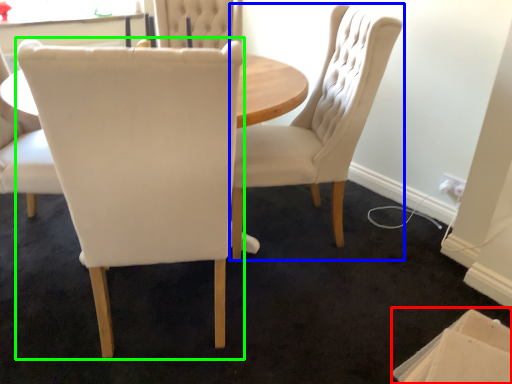
Question: Estimate the real-world distances between objects in this image. Which object is closer to cardboard box (highlighted by a red box), chair (highlighted by a blue box) or chair (highlighted by a green box)?

Choices:
 (A) chair
 (B) chair

Answer: (A)